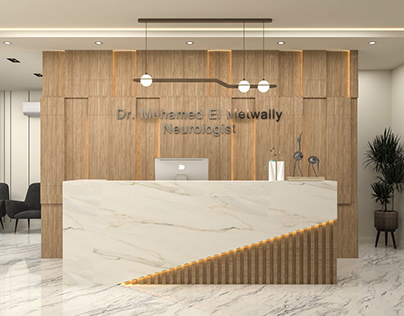
This screenshot has width=404, height=316. I want to click on plant, so click(384, 155).